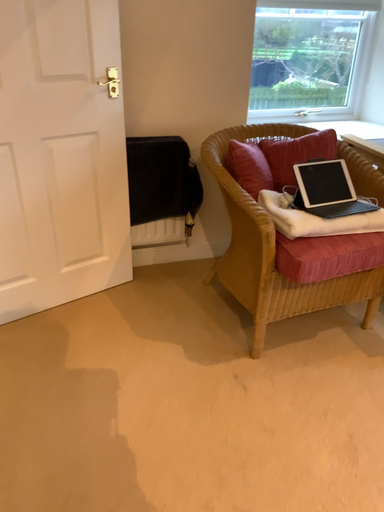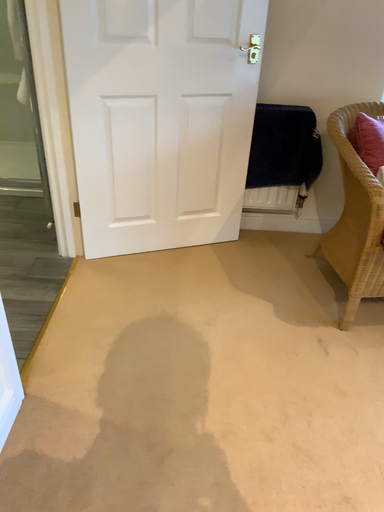
Question: How did the camera likely rotate when shooting the video?

Choices:
 (A) rotated left
 (B) rotated right

Answer: (A)